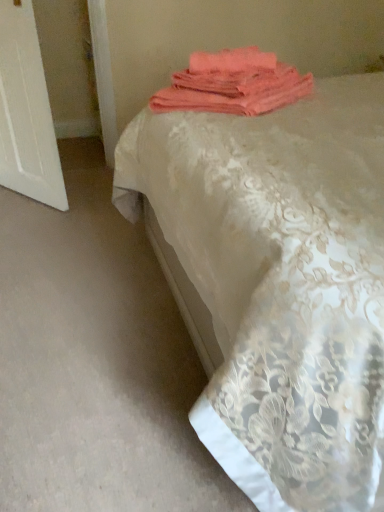
Describe the element at coordinates (280, 282) in the screenshot. I see `silky lace bedspread at center` at that location.

The height and width of the screenshot is (512, 384). I want to click on white wood door at left, so click(26, 111).

Considering the sizes of objects white wood door at left and coral fabric towel at upper center in the image provided, who is bigger, white wood door at left or coral fabric towel at upper center?

white wood door at left.

Are white wood door at left and coral fabric towel at upper center making contact?

No, white wood door at left is not in contact with coral fabric towel at upper center.

You are a GUI agent. You are given a task and a screenshot of the screen. Output one action in this format:
    pyautogui.click(x=<x>, y=<y>)
    Task: Click on the screen door behind the coral fabric towel at upper center
    The image size is (384, 512).
    Given the screenshot: What is the action you would take?
    pyautogui.click(x=26, y=111)

What's the angular difference between white wood door at left and coral fabric towel at upper center's facing directions?

93.6 degrees separate the facing orientations of white wood door at left and coral fabric towel at upper center.

Locate an element on the screen. screen door behind the silky lace bedspread at center is located at coordinates (26, 111).

Is silky lace bedspread at center far away from white wood door at left?

Indeed, silky lace bedspread at center is not near white wood door at left.

Considering the relative sizes of silky lace bedspread at center and white wood door at left in the image provided, is silky lace bedspread at center smaller than white wood door at left?

Actually, silky lace bedspread at center might be larger than white wood door at left.

Between silky lace bedspread at center and white wood door at left, which one has more height?

silky lace bedspread at center is taller.

Which object is further away from the camera taking this photo, white wood door at left or silky lace bedspread at center?

white wood door at left is further from the camera.

Does point (18, 41) come closer to viewer compared to point (380, 210)?

No.

From a real-world perspective, is white wood door at left positioned under silky lace bedspread at center based on gravity?

Yes.

Is white wood door at left thinner than silky lace bedspread at center?

Correct, the width of white wood door at left is less than that of silky lace bedspread at center.

Which of these two, silky lace bedspread at center or coral fabric towel at upper center, is smaller?

coral fabric towel at upper center.

From a real-world perspective, relative to coral fabric towel at upper center, is silky lace bedspread at center vertically above or below?

From a real-world perspective, silky lace bedspread at center is physically below coral fabric towel at upper center.

In terms of width, does silky lace bedspread at center look wider or thinner when compared to coral fabric towel at upper center?

In the image, silky lace bedspread at center appears to be wider than coral fabric towel at upper center.

Which is more to the right, silky lace bedspread at center or coral fabric towel at upper center?

silky lace bedspread at center is more to the right.

Is coral fabric towel at upper center positioned with its back to white wood door at left?

No, coral fabric towel at upper center's orientation is not away from white wood door at left.

You are a GUI agent. You are given a task and a screenshot of the screen. Output one action in this format:
    pyautogui.click(x=<x>, y=<y>)
    Task: Click on the towel on the right of the white wood door at left
    
    Given the screenshot: What is the action you would take?
    pyautogui.click(x=233, y=84)

What's the angular difference between coral fabric towel at upper center and white wood door at left's facing directions?

There is a 93.6-degree angle between the facing directions of coral fabric towel at upper center and white wood door at left.

Which object is thinner, coral fabric towel at upper center or white wood door at left?

white wood door at left is thinner.

Which of these two, coral fabric towel at upper center or silky lace bedspread at center, stands taller?

Standing taller between the two is silky lace bedspread at center.

Is coral fabric towel at upper center spatially inside silky lace bedspread at center, or outside of it?

coral fabric towel at upper center is contained in silky lace bedspread at center.

Is coral fabric towel at upper center oriented away from silky lace bedspread at center?

Yes, silky lace bedspread at center is at the back of coral fabric towel at upper center.

I want to click on screen door behind the coral fabric towel at upper center, so click(26, 111).

Identify the location of bed lying on the right of white wood door at left. (280, 282).

When comparing their distances from white wood door at left, does silky lace bedspread at center or coral fabric towel at upper center seem further?

The object further to white wood door at left is silky lace bedspread at center.

Looking at this image, based on their spatial positions, is coral fabric towel at upper center or white wood door at left closer to silky lace bedspread at center?

coral fabric towel at upper center lies closer to silky lace bedspread at center than the other object.

Considering their positions, is white wood door at left positioned closer to coral fabric towel at upper center than silky lace bedspread at center?

silky lace bedspread at center.

Estimate the real-world distances between objects in this image. Which object is further from white wood door at left, coral fabric towel at upper center or silky lace bedspread at center?

Based on the image, silky lace bedspread at center appears to be further to white wood door at left.

Considering their positions, is silky lace bedspread at center positioned closer to coral fabric towel at upper center than white wood door at left?

silky lace bedspread at center lies closer to coral fabric towel at upper center than the other object.

Looking at the image, which one is located further to silky lace bedspread at center, white wood door at left or coral fabric towel at upper center?

white wood door at left.

Image resolution: width=384 pixels, height=512 pixels. What are the coordinates of `towel between white wood door at left and silky lace bedspread at center` in the screenshot? It's located at (233, 84).